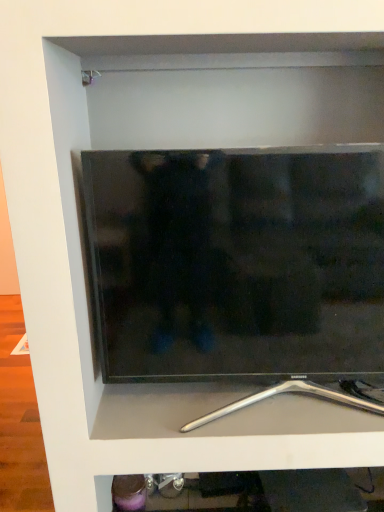
This screenshot has width=384, height=512. I want to click on free spot above metallic silver stand at bottom (from a real-world perspective), so click(x=248, y=398).